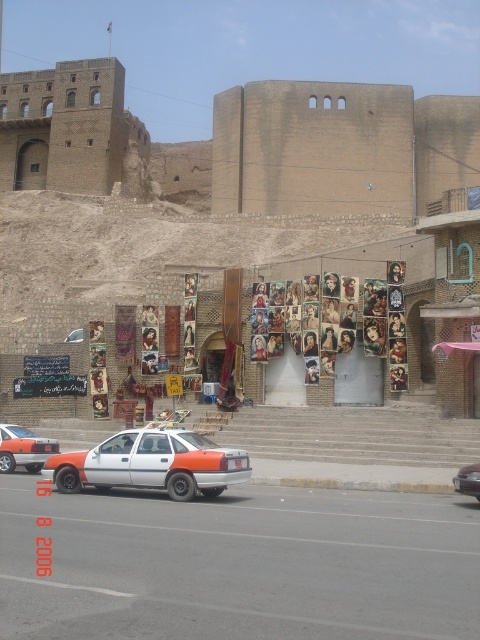
From the picture: Between orange matte car at center and matte white sedan at center, which one has less height?

matte white sedan at center is shorter.

Which is more to the right, orange matte car at center or matte white sedan at center?

From the viewer's perspective, matte white sedan at center appears more on the right side.

You are a GUI agent. You are given a task and a screenshot of the screen. Output one action in this format:
    pyautogui.click(x=<x>, y=<y>)
    Task: Click on the orange matte car at center
    Image resolution: width=480 pixels, height=640 pixels.
    Given the screenshot: What is the action you would take?
    pyautogui.click(x=152, y=464)

Find the location of a particular element. This screenshot has width=480, height=640. orange matte car at center is located at coordinates (152, 464).

Which of these two, orange matte car at center or orange matte sedan at center, stands shorter?

orange matte sedan at center

Is point (156, 432) farther from camera compared to point (36, 442)?

No, it is not.

Does point (49, 465) lie in front of point (22, 442)?

Yes, it is.

This screenshot has height=640, width=480. I want to click on orange matte car at center, so click(x=152, y=464).

Between white plastic car at center and orange matte sedan at center, which one is positioned higher?

orange matte sedan at center is higher up.

Between point (395, 572) and point (7, 445), which one is positioned behind?

The point (7, 445) is more distant.

Identify the location of white plastic car at center. This screenshot has height=640, width=480. (240, 564).